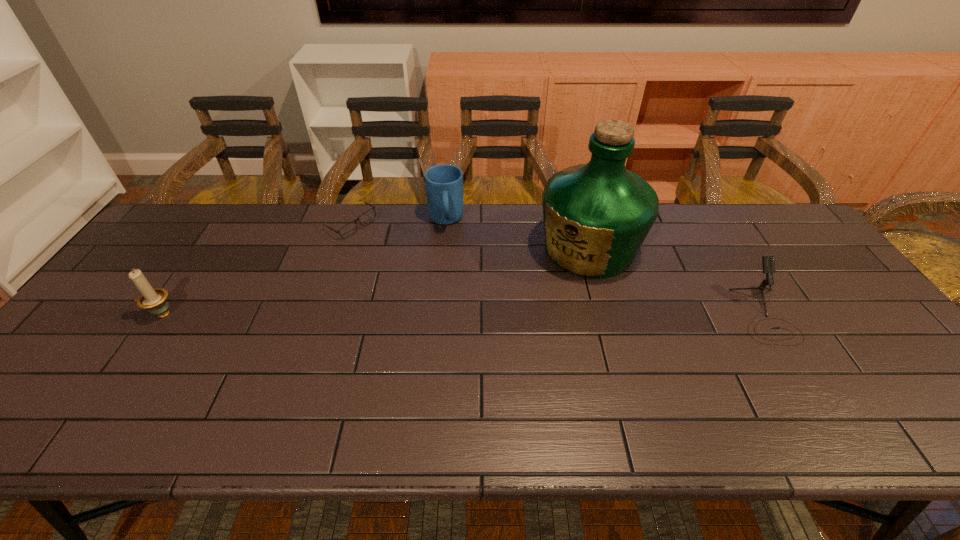
Where is `the leftmost object`? the leftmost object is located at coordinates (154, 300).

I want to click on microphone, so click(x=768, y=263).

Find the location of a particular element. the rightmost object is located at coordinates (768, 263).

Find the location of `mug`. mug is located at coordinates (444, 183).

Find the location of a particular element. The width and height of the screenshot is (960, 540). the fourth object from left to right is located at coordinates (596, 215).

You are a GUI agent. You are given a task and a screenshot of the screen. Output one action in this format:
    pyautogui.click(x=<x>, y=<y>)
    Task: Click on the tallest object
    The height and width of the screenshot is (540, 960).
    Given the screenshot: What is the action you would take?
    pyautogui.click(x=596, y=215)

Where is `the second object from left to right`? The height and width of the screenshot is (540, 960). the second object from left to right is located at coordinates (349, 229).

At what (x,y) coordinates should I click in order to perform the action: click on spectacles. Please return your answer as a coordinate pair (x, y). The width and height of the screenshot is (960, 540). Looking at the image, I should click on (349, 229).

Where is `free location located on the handle side of the leftmost object`? The width and height of the screenshot is (960, 540). free location located on the handle side of the leftmost object is located at coordinates (103, 314).

Image resolution: width=960 pixels, height=540 pixels. Identify the location of free spot located 0.090m on the handle side of the leftmost object. (110, 314).